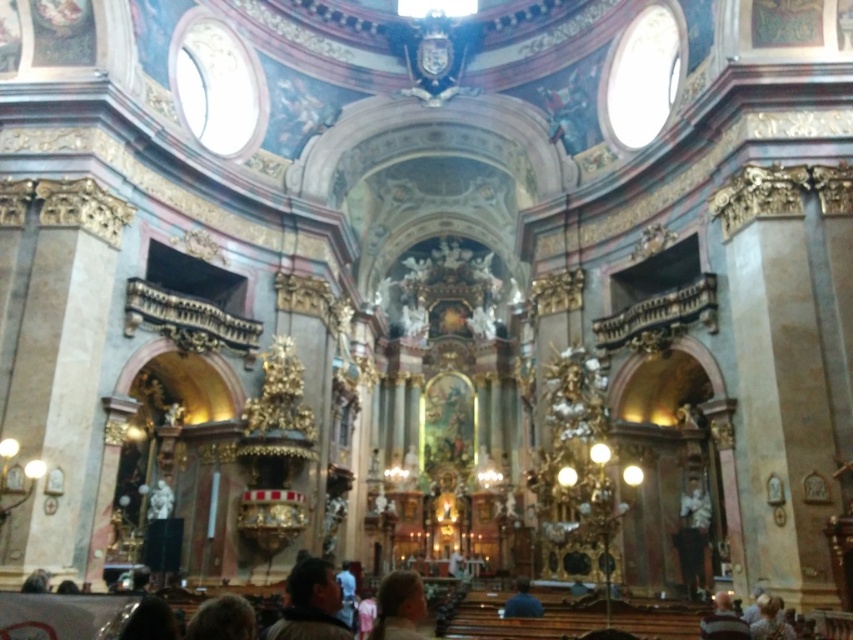
Which is more to the left, white statue at right or light brown hair at lower center?

Positioned to the left is light brown hair at lower center.

Who is taller, white statue at right or light brown hair at lower center?

With more height is light brown hair at lower center.

Is point (685, 573) positioned in front of point (397, 596)?

No, it is behind (397, 596).

Locate an element on the screen. The width and height of the screenshot is (853, 640). white statue at right is located at coordinates (694, 538).

Is point (401, 572) behind point (514, 614)?

Yes.

Which is in front, point (410, 625) or point (535, 612)?

Point (410, 625) is in front.

Locate an element on the screen. light brown hair at lower center is located at coordinates (399, 605).

Is the position of white statue at right more distant than that of light brown leather jacket at lower center?

Yes.

The width and height of the screenshot is (853, 640). Describe the element at coordinates (694, 538) in the screenshot. I see `white statue at right` at that location.

Does point (686, 506) lie behind point (535, 609)?

Yes.

You are a GUI agent. You are given a task and a screenshot of the screen. Output one action in this format:
    pyautogui.click(x=<x>, y=<y>)
    Task: Click on the white statue at right
    The width and height of the screenshot is (853, 640).
    Given the screenshot: What is the action you would take?
    pyautogui.click(x=694, y=538)